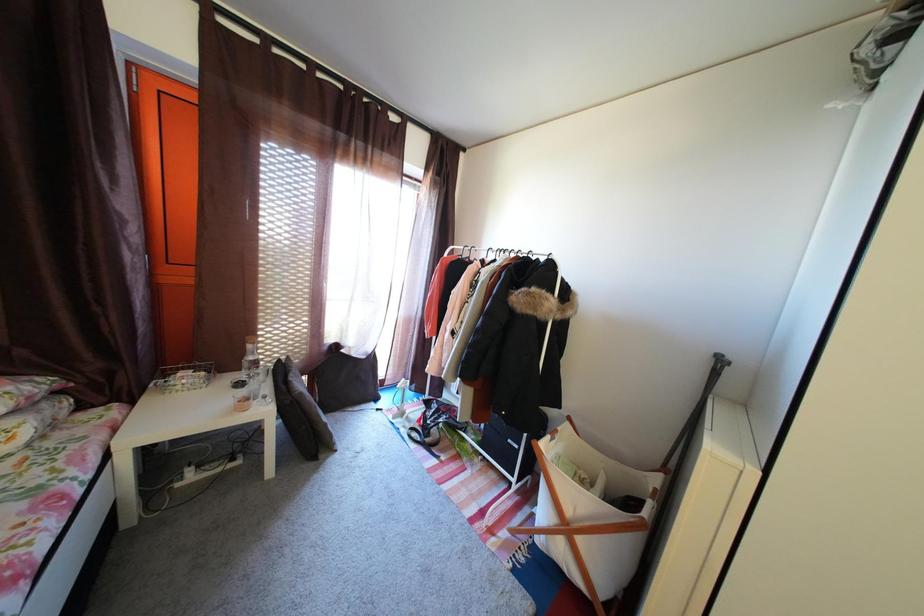
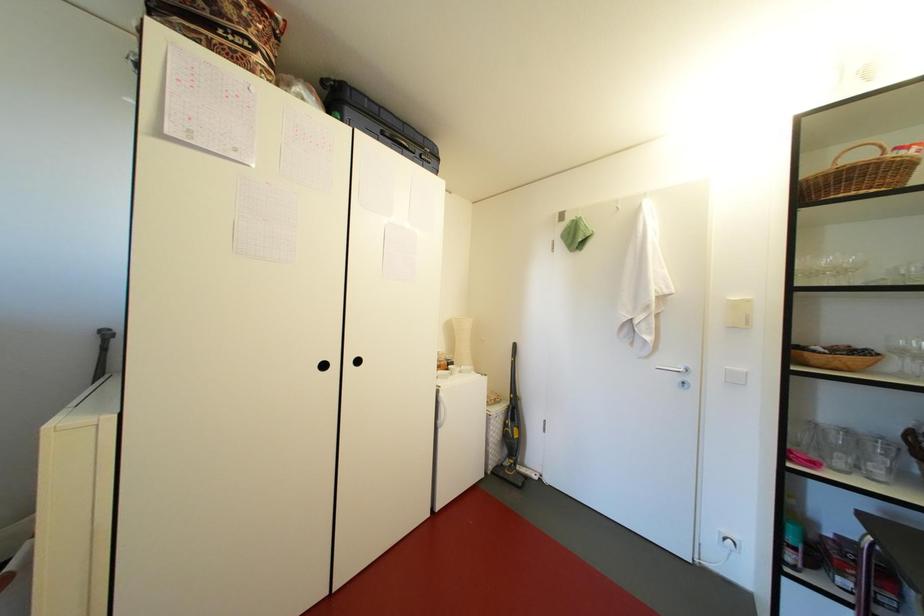
Question: How did the camera likely rotate?

Choices:
 (A) Left
 (B) Right
 (C) Up
 (D) Down

Answer: (B)